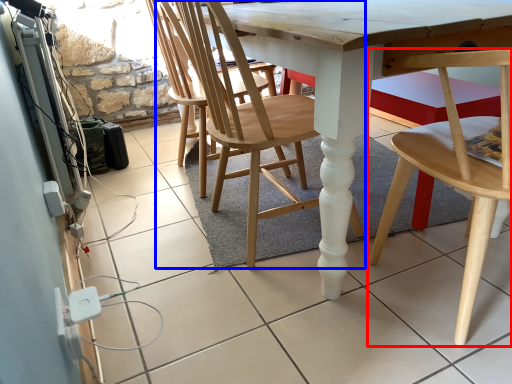
Question: Among these objects, which one is farthest to the camera, chair (highlighted by a red box) or chair (highlighted by a blue box)?

Choices:
 (A) chair
 (B) chair

Answer: (B)